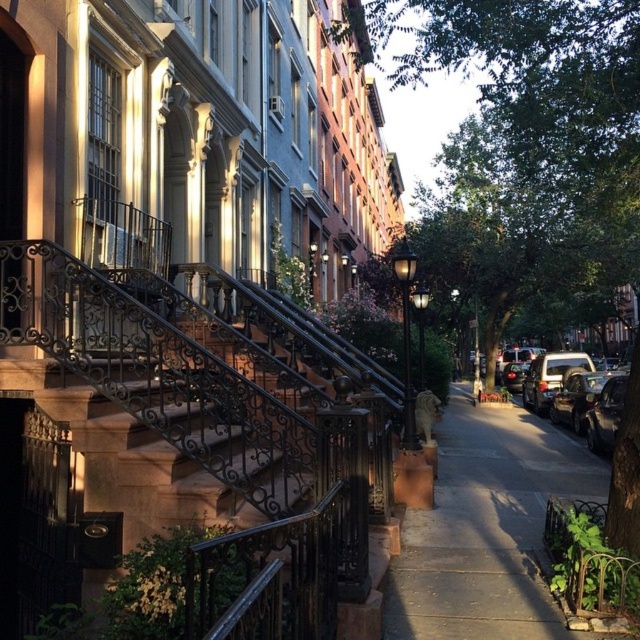
Based on the photo, is brown concrete sidewalk at center positioned at the back of shiny black car at right?

No, brown concrete sidewalk at center is in front of shiny black car at right.

Measure the distance between point (x=513, y=477) and camera.

Point (x=513, y=477) is 10.63 meters from camera.

Image resolution: width=640 pixels, height=640 pixels. Find the location of `brown concrete sidewalk at center`. brown concrete sidewalk at center is located at coordinates (486, 529).

In the scene shown: Measure the distance between point (52, 326) and camera.

They are 19.93 feet apart.

Which is in front, point (246, 451) or point (557, 416)?

Point (246, 451) is more forward.

Does point (64, 264) come farther from viewer compared to point (616, 422)?

No, (64, 264) is in front of (616, 422).

Identify the location of black wrought iron balustrade at center. The height and width of the screenshot is (640, 640). (216, 440).

Is black wrought iron balustrade at center to the left of green leafy tree at center from the viewer's perspective?

Yes, black wrought iron balustrade at center is to the left of green leafy tree at center.

In the scene shown: Measure the distance from black wrought iron balustrade at center to green leafy tree at center.

The distance of black wrought iron balustrade at center from green leafy tree at center is 4.54 meters.

Is point (17, 243) closer to camera compared to point (476, 4)?

That is True.

Identify the location of black wrought iron balustrade at center. The image size is (640, 640). (216, 440).